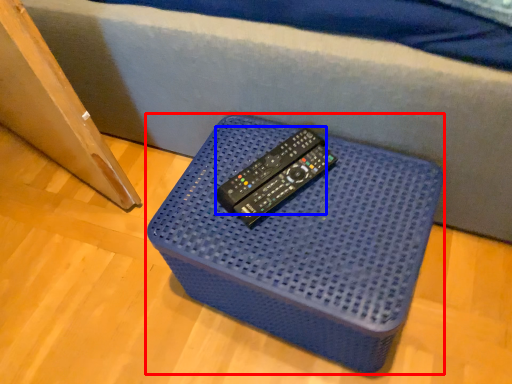
Question: Which object appears farthest to the camera in this image, furniture (highlighted by a red box) or remote (highlighted by a blue box)?

Choices:
 (A) furniture
 (B) remote

Answer: (B)